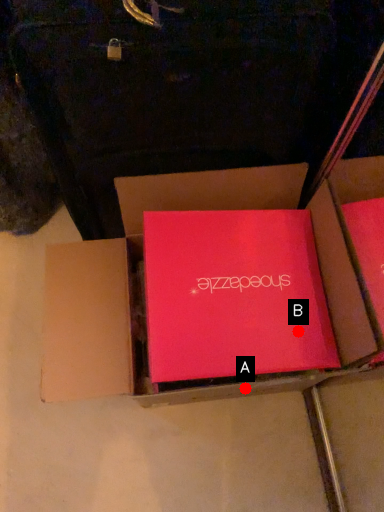
Question: Two points are circled on the image, labeled by A and B beside each circle. Which point appears closest to the camera in this image?

Choices:
 (A) A is closer
 (B) B is closer

Answer: (B)